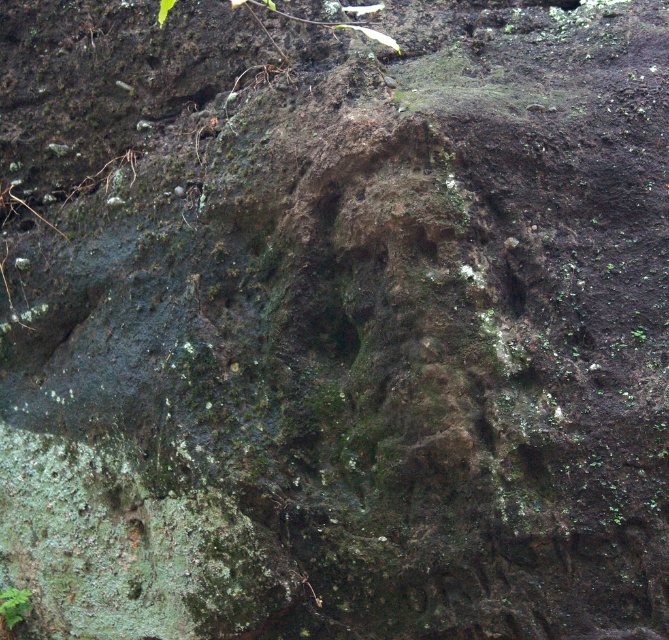
Question: Can you confirm if green mossy plant at lower left is positioned to the right of green mossy plant at center?

Choices:
 (A) no
 (B) yes

Answer: (A)

Question: Can you confirm if green mossy plant at lower left is wider than green mossy plant at center?

Choices:
 (A) no
 (B) yes

Answer: (B)

Question: Which object appears closest to the camera in this image?

Choices:
 (A) green mossy plant at center
 (B) green mossy plant at lower left

Answer: (A)

Question: Is green mossy plant at lower left positioned at the back of green mossy plant at center?

Choices:
 (A) yes
 (B) no

Answer: (A)